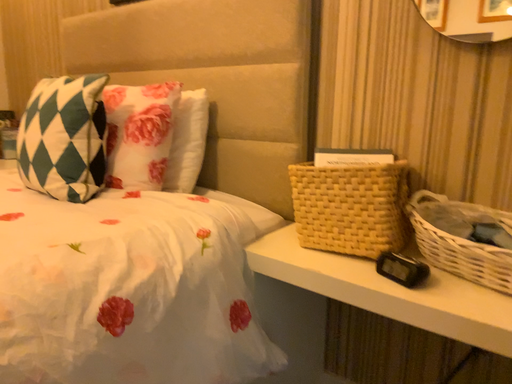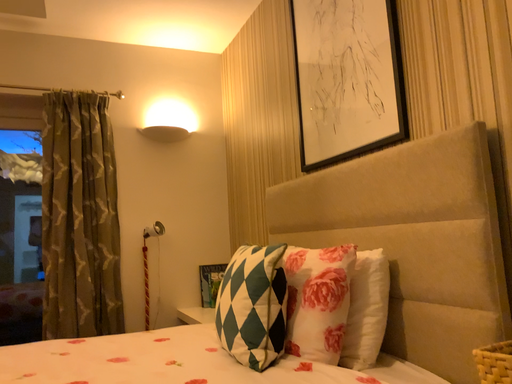
Question: Which way did the camera rotate in the video?

Choices:
 (A) rotated downward
 (B) rotated upward

Answer: (B)